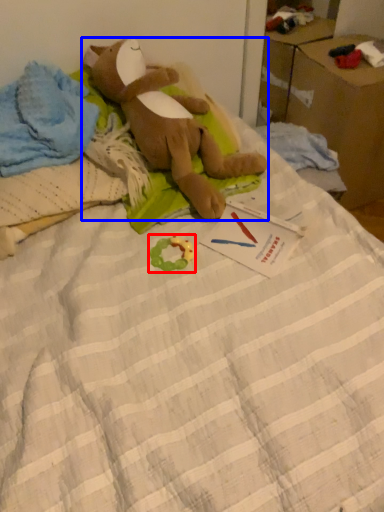
Question: Which object appears farthest to the camera in this image, toy (highlighted by a red box) or toy (highlighted by a blue box)?

Choices:
 (A) toy
 (B) toy

Answer: (A)